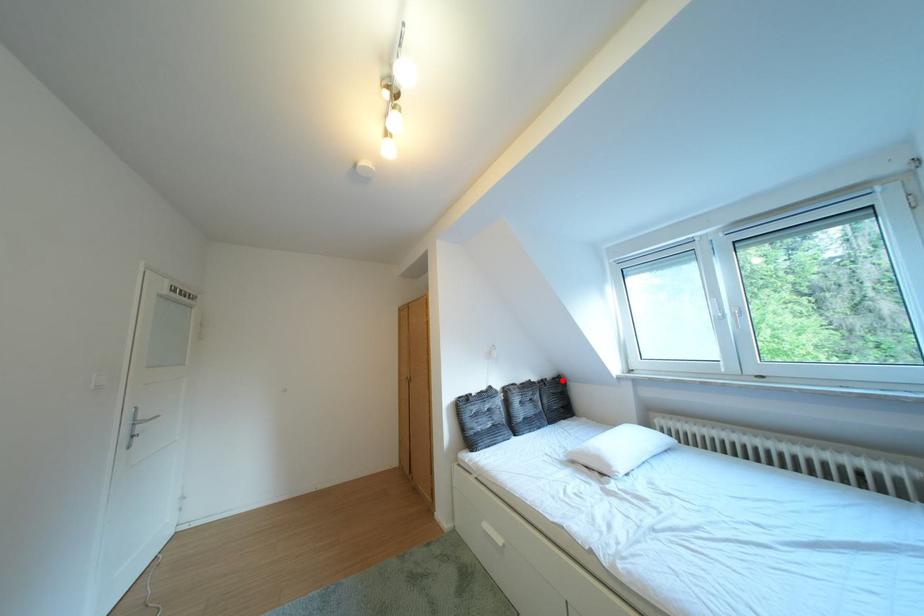
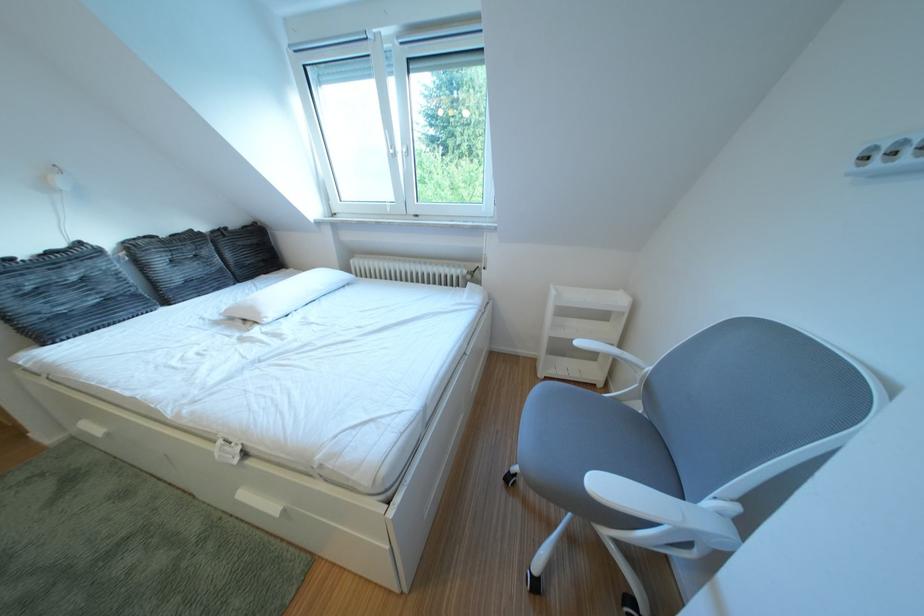
Question: I am providing you with two images of the same scene from different viewpoints. Image1 has a red point marked. In image2, the corresponding 3D location appears at what relative position? Reply with the corresponding letter.

Choices:
 (A) Closer
 (B) Farther

Answer: (A)